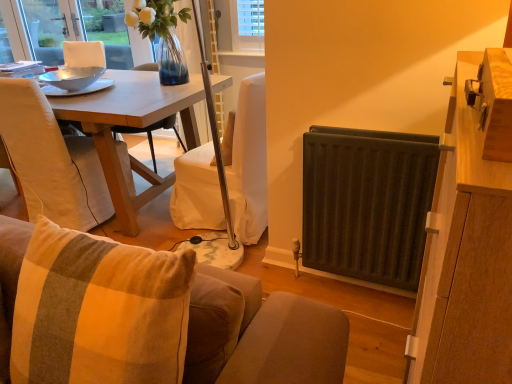
Question: Are plush fabric couch at lower center and wooden table at center located far from each other?

Choices:
 (A) yes
 (B) no

Answer: (A)

Question: Could you tell me if plush fabric couch at lower center is facing wooden table at center?

Choices:
 (A) no
 (B) yes

Answer: (A)

Question: From a real-world perspective, is plush fabric couch at lower center beneath wooden table at center?

Choices:
 (A) no
 (B) yes

Answer: (A)

Question: Can you confirm if plush fabric couch at lower center is wider than wooden table at center?

Choices:
 (A) yes
 (B) no

Answer: (B)

Question: Is wooden table at center at the back of plush fabric couch at lower center?

Choices:
 (A) no
 (B) yes

Answer: (A)

Question: Is plush fabric couch at lower center not inside wooden table at center?

Choices:
 (A) no
 (B) yes

Answer: (B)

Question: Can you confirm if beige fabric chair at left is positioned to the left of wooden cabinet at right?

Choices:
 (A) yes
 (B) no

Answer: (A)

Question: Does beige fabric chair at left lie in front of wooden cabinet at right?

Choices:
 (A) no
 (B) yes

Answer: (A)

Question: Is beige fabric chair at left thinner than wooden cabinet at right?

Choices:
 (A) no
 (B) yes

Answer: (A)

Question: Is wooden cabinet at right a part of beige fabric chair at left?

Choices:
 (A) no
 (B) yes

Answer: (A)

Question: Can you confirm if beige fabric chair at left is shorter than wooden cabinet at right?

Choices:
 (A) no
 (B) yes

Answer: (B)

Question: Considering the relative sizes of beige fabric chair at left and wooden cabinet at right in the image provided, is beige fabric chair at left bigger than wooden cabinet at right?

Choices:
 (A) no
 (B) yes

Answer: (A)

Question: Is dark gray metal radiator at right smaller than wooden cabinet at right?

Choices:
 (A) yes
 (B) no

Answer: (A)